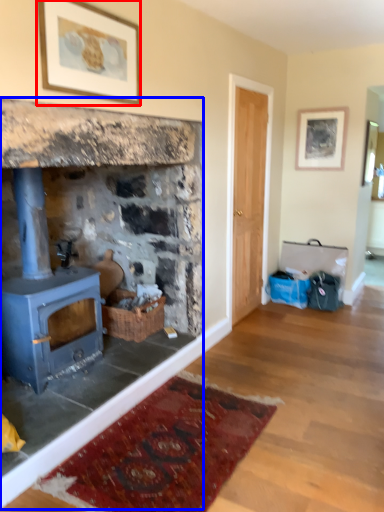
Question: Which object appears farthest to the camera in this image, picture frame (highlighted by a red box) or fireplace (highlighted by a blue box)?

Choices:
 (A) picture frame
 (B) fireplace

Answer: (A)